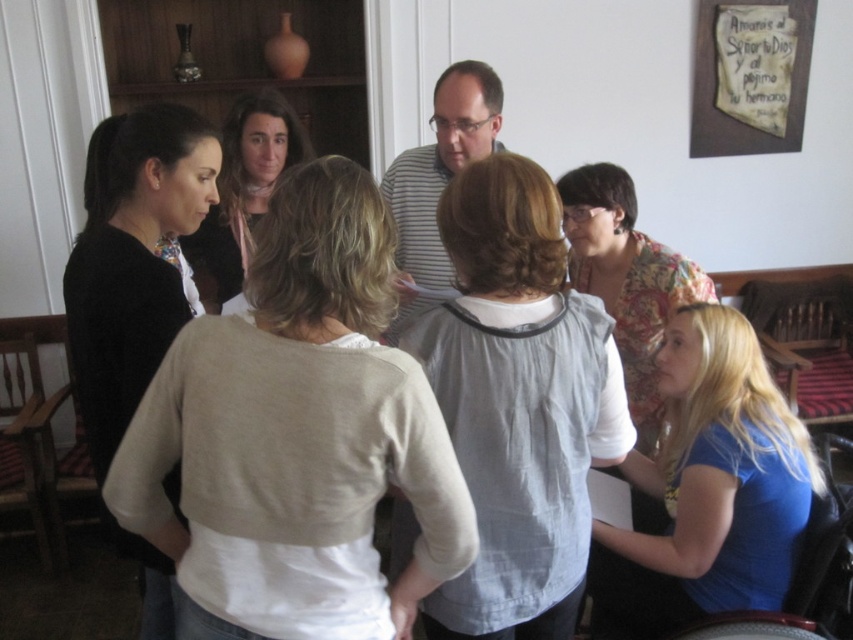
Does point (459, 589) lie in front of point (155, 259)?

Yes, point (459, 589) is closer to viewer.

How distant is light gray cotton blouse at center from black matte sweater at left?

light gray cotton blouse at center is 22.65 inches away from black matte sweater at left.

The height and width of the screenshot is (640, 853). Identify the location of light gray cotton blouse at center. (518, 403).

Does floral fabric blouse at center have a larger size compared to smooth beige blouse at center?

Incorrect, floral fabric blouse at center is not larger than smooth beige blouse at center.

Between floral fabric blouse at center and smooth beige blouse at center, which one is positioned lower?

floral fabric blouse at center

Does point (670, 275) come in front of point (291, 148)?

Yes, point (670, 275) is in front of point (291, 148).

At what (x,y) coordinates should I click in order to perform the action: click on floral fabric blouse at center. Please return your answer as a coordinate pair (x, y). This screenshot has height=640, width=853. Looking at the image, I should click on (627, 282).

Does light gray cotton blouse at center have a smaller size compared to floral fabric blouse at center?

Yes, light gray cotton blouse at center is smaller than floral fabric blouse at center.

I want to click on light gray cotton blouse at center, so click(518, 403).

Where is `light gray cotton blouse at center`? Image resolution: width=853 pixels, height=640 pixels. light gray cotton blouse at center is located at coordinates (518, 403).